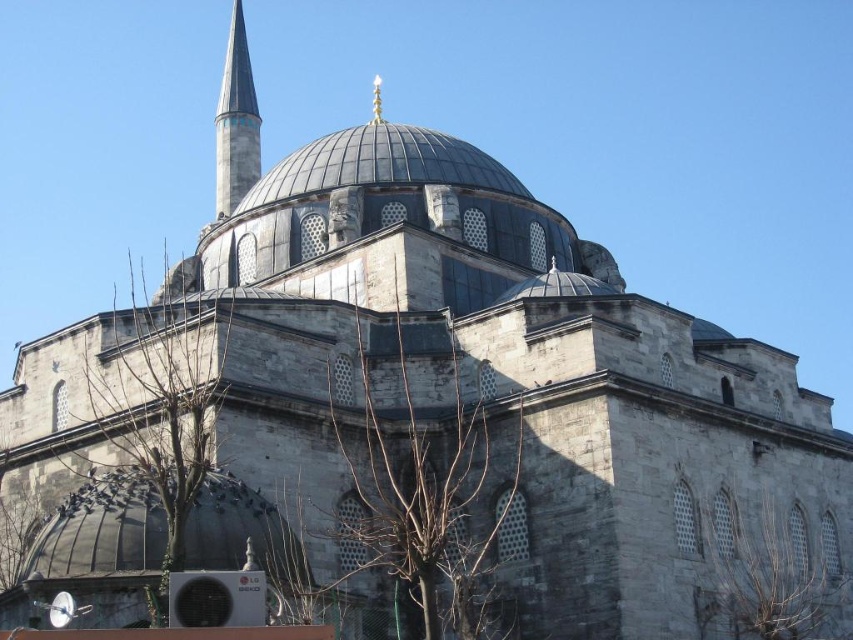
Can you confirm if gray stone dome at center is taller than smooth white minaret at upper left?

No, gray stone dome at center is not taller than smooth white minaret at upper left.

From the picture: Does gray stone dome at center lie in front of smooth white minaret at upper left?

That is True.

What do you see at coordinates (102, 531) in the screenshot? The width and height of the screenshot is (853, 640). I see `gray stone dome at center` at bounding box center [102, 531].

Identify the location of gray stone dome at center. The height and width of the screenshot is (640, 853). (102, 531).